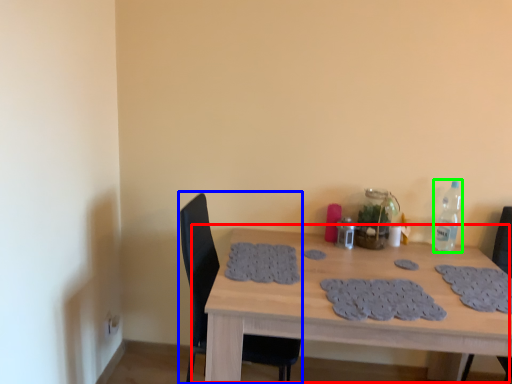
Question: Considering the real-world distances, which object is closest to table (highlighted by a red box)? chair (highlighted by a blue box) or bottle (highlighted by a green box).

Choices:
 (A) chair
 (B) bottle

Answer: (A)